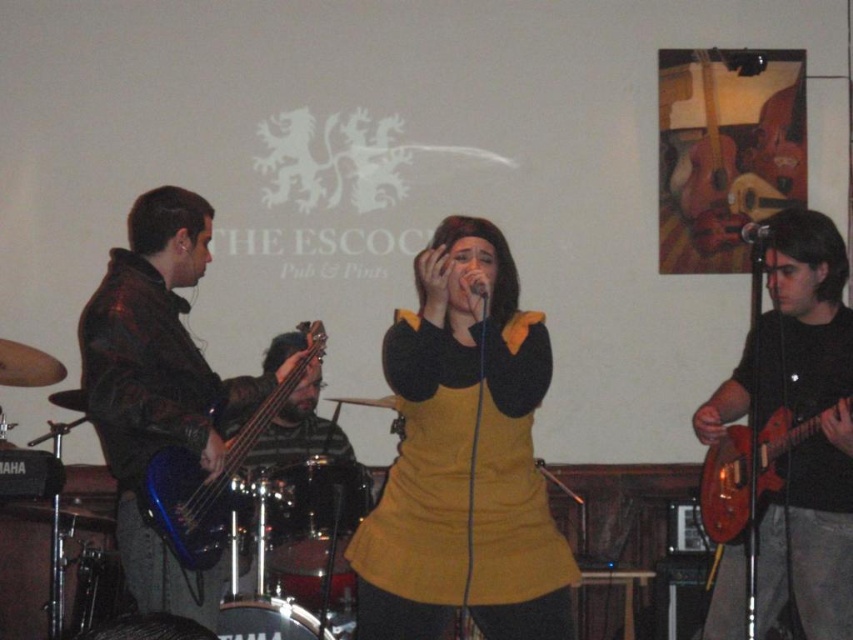
Who is lower down, yellow matte dress at center or shiny red guitar at right?

shiny red guitar at right is lower down.

Between yellow matte dress at center and shiny red guitar at right, which one appears on the right side from the viewer's perspective?

shiny red guitar at right is more to the right.

Image resolution: width=853 pixels, height=640 pixels. I want to click on yellow matte dress at center, so click(463, 458).

Can you confirm if camouflage jacket at left is positioned above shiny red electric guitar at right?

Indeed, camouflage jacket at left is positioned over shiny red electric guitar at right.

This screenshot has height=640, width=853. What are the coordinates of `camouflage jacket at left` in the screenshot? It's located at (160, 387).

Looking at this image, between shiny red guitar at right and shiny red electric guitar at right, which one has more height?

With more height is shiny red guitar at right.

The height and width of the screenshot is (640, 853). I want to click on shiny red guitar at right, so click(801, 417).

Where is `shiny red guitar at right`? The height and width of the screenshot is (640, 853). shiny red guitar at right is located at coordinates coord(801,417).